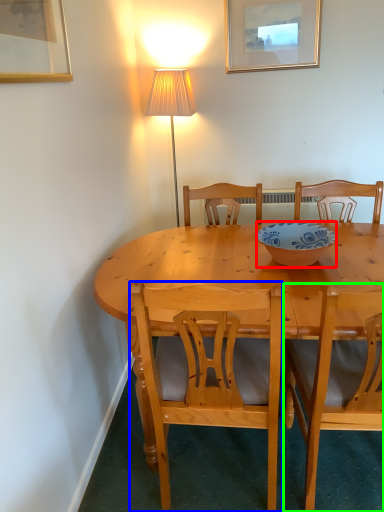
Question: Estimate the real-world distances between objects in this image. Which object is farther from bowl (highlighted by a red box), chair (highlighted by a blue box) or chair (highlighted by a green box)?

Choices:
 (A) chair
 (B) chair

Answer: (A)